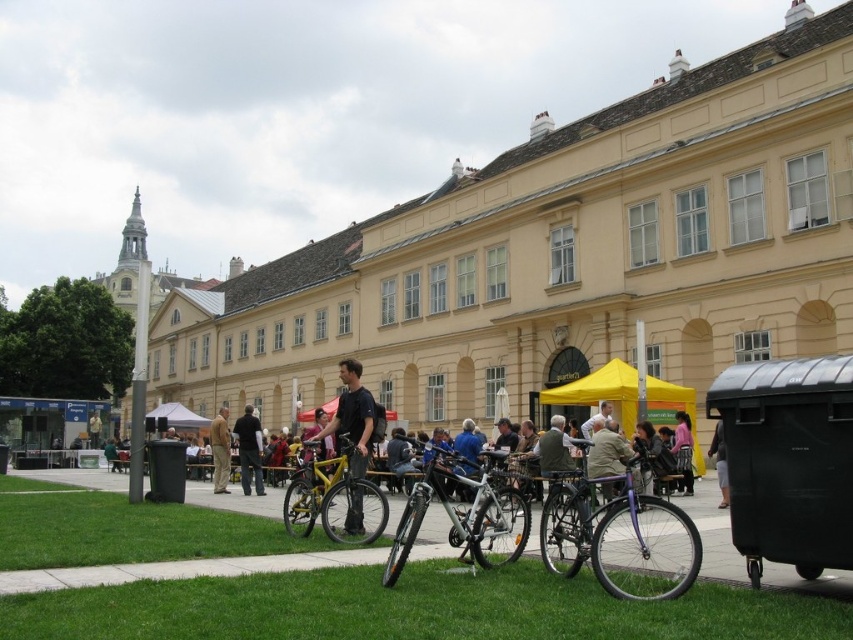
You are standing in front of the beige building with the clock tower. You want to place a picnic blanket on the green grass at lower center. To ensure accuracy, what coordinates should you aim for?

The green grass at lower center is located at coordinates point (413,609), so you should aim for those coordinates to place the picnic blanket.

You are a visitor at this historical building and want to place your bag on the ground near the purple metallic bicycle at center and the dark pink fabric at lower center. Where should you put it so that it is between both objects?

You should place your bag between the purple metallic bicycle at center and the dark pink fabric at lower center since the purple metallic bicycle at center is to the left of dark pink fabric at lower center.